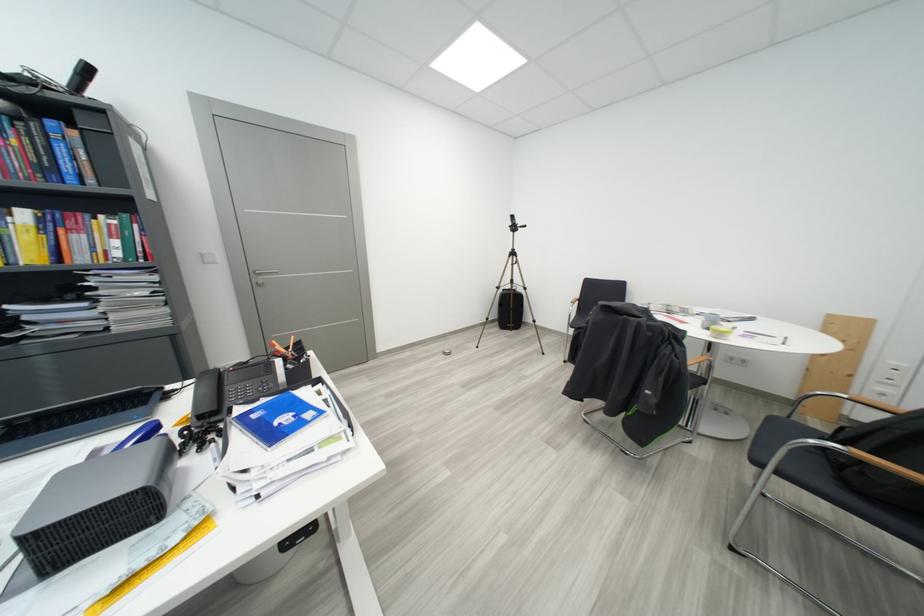
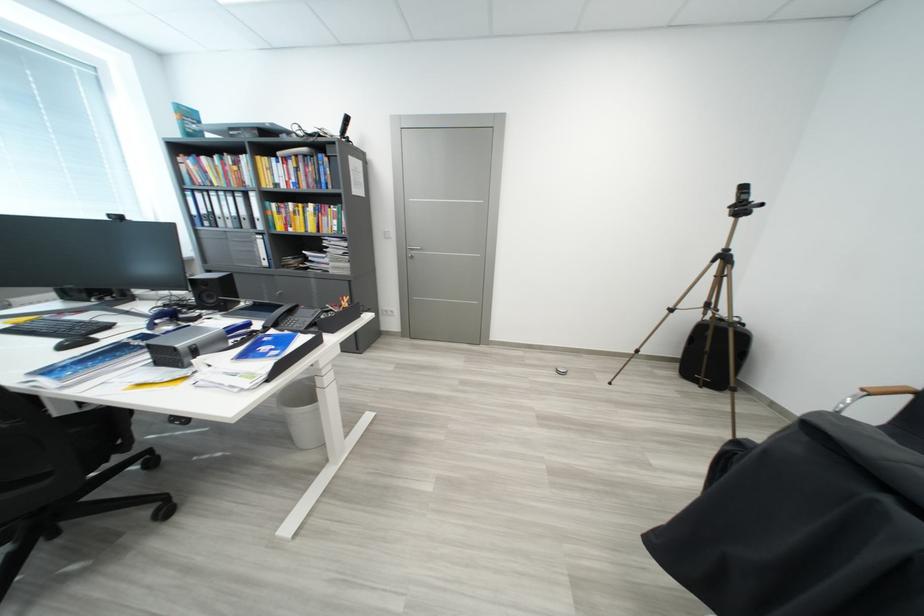
Find the pixel in the second image that matches (209,419) in the first image.

(274, 330)